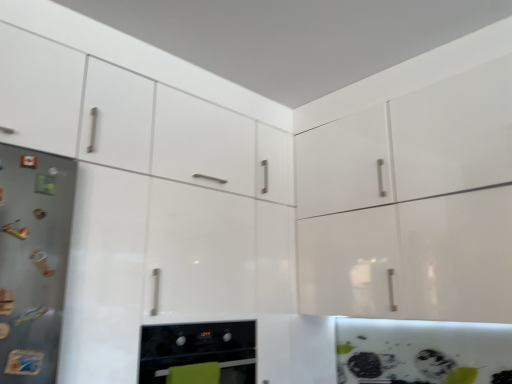
Question: Is matte black oven at lower center turned away from satin steel refrigerator at left?

Choices:
 (A) no
 (B) yes

Answer: (A)

Question: Considering the relative sizes of matte black oven at lower center and satin steel refrigerator at left in the image provided, is matte black oven at lower center wider than satin steel refrigerator at left?

Choices:
 (A) no
 (B) yes

Answer: (B)

Question: Is the depth of matte black oven at lower center greater than that of satin steel refrigerator at left?

Choices:
 (A) no
 (B) yes

Answer: (B)

Question: Considering the relative positions of matte black oven at lower center and satin steel refrigerator at left in the image provided, is matte black oven at lower center to the left of satin steel refrigerator at left from the viewer's perspective?

Choices:
 (A) yes
 (B) no

Answer: (B)

Question: Could you tell me if matte black oven at lower center is facing satin steel refrigerator at left?

Choices:
 (A) yes
 (B) no

Answer: (B)

Question: From the image's perspective, does matte black oven at lower center appear lower than satin steel refrigerator at left?

Choices:
 (A) yes
 (B) no

Answer: (A)

Question: Is satin steel refrigerator at left thinner than matte black oven at lower center?

Choices:
 (A) yes
 (B) no

Answer: (A)

Question: Is the depth of satin steel refrigerator at left greater than that of matte black oven at lower center?

Choices:
 (A) yes
 (B) no

Answer: (B)

Question: Can you confirm if satin steel refrigerator at left is bigger than matte black oven at lower center?

Choices:
 (A) no
 (B) yes

Answer: (A)

Question: Does satin steel refrigerator at left have a lesser height compared to matte black oven at lower center?

Choices:
 (A) yes
 (B) no

Answer: (B)

Question: Is there a large distance between satin steel refrigerator at left and matte black oven at lower center?

Choices:
 (A) yes
 (B) no

Answer: (B)

Question: Would you say satin steel refrigerator at left is outside matte black oven at lower center?

Choices:
 (A) no
 (B) yes

Answer: (B)

Question: From a real-world perspective, relative to satin steel refrigerator at left, is matte black oven at lower center vertically above or below?

Choices:
 (A) below
 (B) above

Answer: (A)